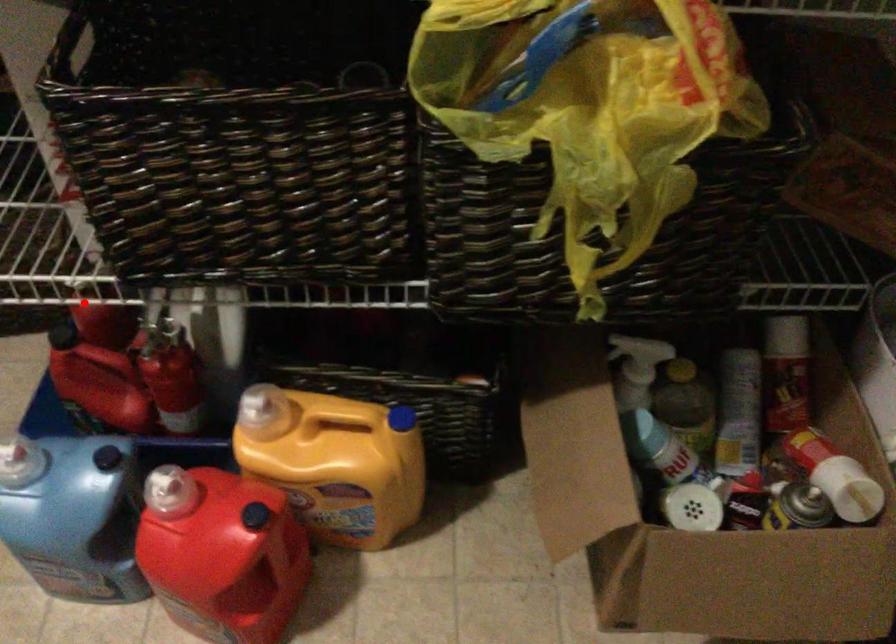
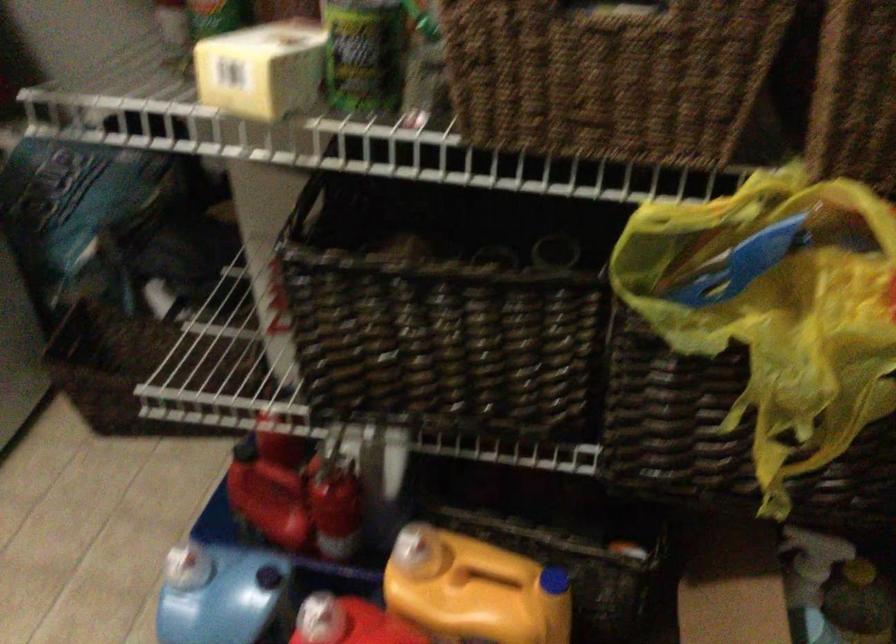
Locate, in the second image, the point that corresponds to the highlighted location in the first image.

(269, 426)